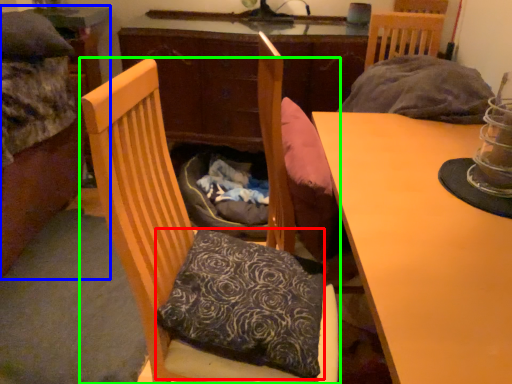
Question: Which object is positioned farthest from pillow (highlighted by a red box)? Select from bed (highlighted by a blue box) and chair (highlighted by a green box).

Choices:
 (A) bed
 (B) chair

Answer: (A)